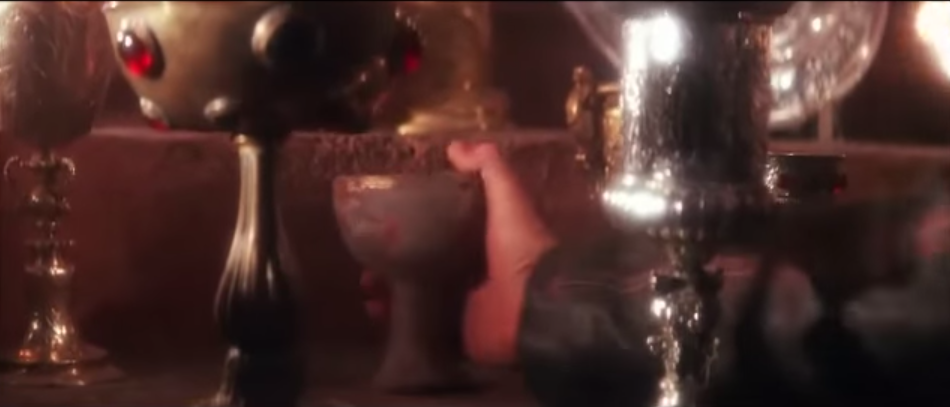
Image resolution: width=950 pixels, height=407 pixels. Identify the location of ornate goblets. (41, 77), (218, 89), (681, 107), (591, 123), (813, 181), (448, 63).